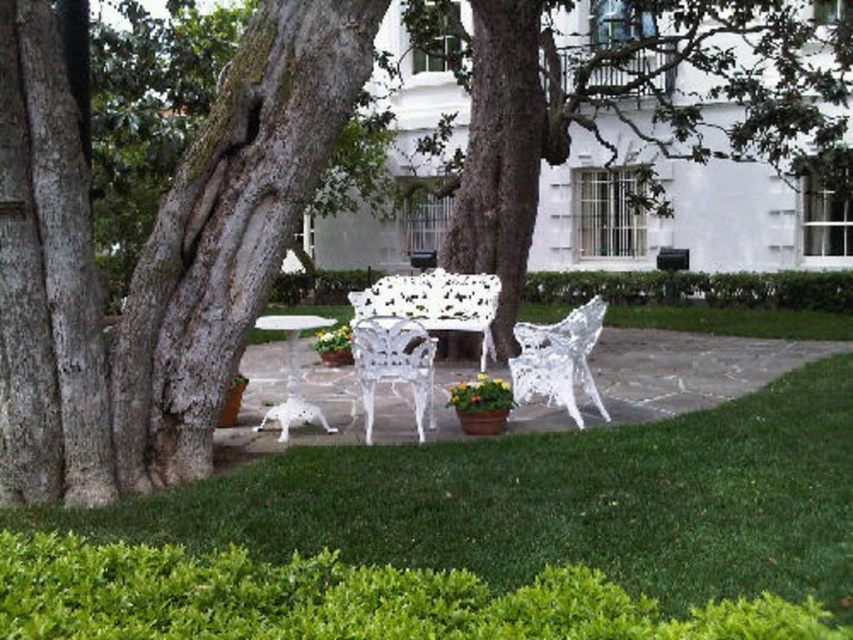
Is point (276, 160) in front of point (473, 307)?

Yes, point (276, 160) is in front of point (473, 307).

The height and width of the screenshot is (640, 853). What are the coordinates of `rough bark tree at left` in the screenshot? It's located at (152, 252).

Does rough bark tree at left appear over white glossy table at center?

Correct, rough bark tree at left is located above white glossy table at center.

Does rough bark tree at left come in front of white glossy table at center?

Yes, rough bark tree at left is closer to the viewer.

Does point (86, 403) lie in front of point (282, 316)?

Yes.

The image size is (853, 640). In order to click on rough bark tree at left in this screenshot , I will do `click(152, 252)`.

How far apart are green grass at lower center and white wrought iron chair at center?

2.67 meters

Can you confirm if green grass at lower center is positioned below white wrought iron chair at center?

Yes.

Does point (651, 429) come farther from viewer compared to point (367, 435)?

No, it is in front of (367, 435).

Image resolution: width=853 pixels, height=640 pixels. I want to click on green grass at lower center, so click(x=476, y=534).